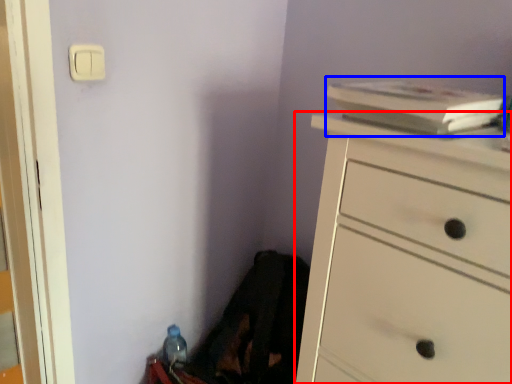
Question: Which point is closer to the camera, chest of drawers (highlighted by a red box) or book (highlighted by a blue box)?

Choices:
 (A) chest of drawers
 (B) book

Answer: (A)